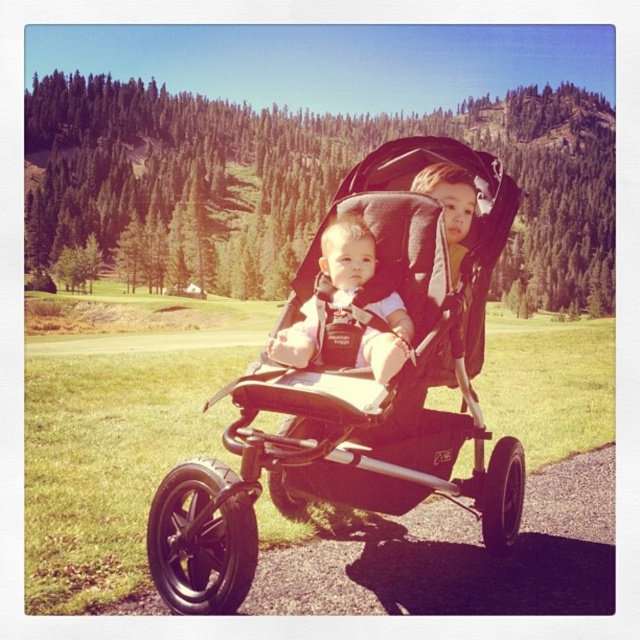
You are a parent pushing the black fabric stroller at center and the matte black baby at center through a narrow garden path that is 26 inches wide. Will you be able to pass through without touching the sides?

The black fabric stroller at center and matte black baby at center are 25.75 inches apart from each other. Since the path is 26 inches wide, there is a 0.25 inch clearance on each side, so you can pass through but must be cautious to avoid touching the sides.

You are a drone operator trying to capture a photo of the black stroller with two children. The camera is positioned at the top of a tall pine tree. To ensure the green grass at center is visible in the photo, where should you aim the camera relative to the black stroller?

The green grass at center is located at point (116, 445) in the 2D space. To include it in the photo, aim the camera slightly below and to the right of the black stroller.

You are a photographer setting up a tripod to capture a closeup of the black fabric stroller at center and the matte black baby at center. Since the tripod has a fixed height, you need to adjust the angle to focus on both subjects. Which subject will require you to tilt the camera upwards more to capture it?

The black fabric stroller at center is taller than the matte black baby at center, so you will need to tilt the camera upwards more to focus on the black fabric stroller at center.